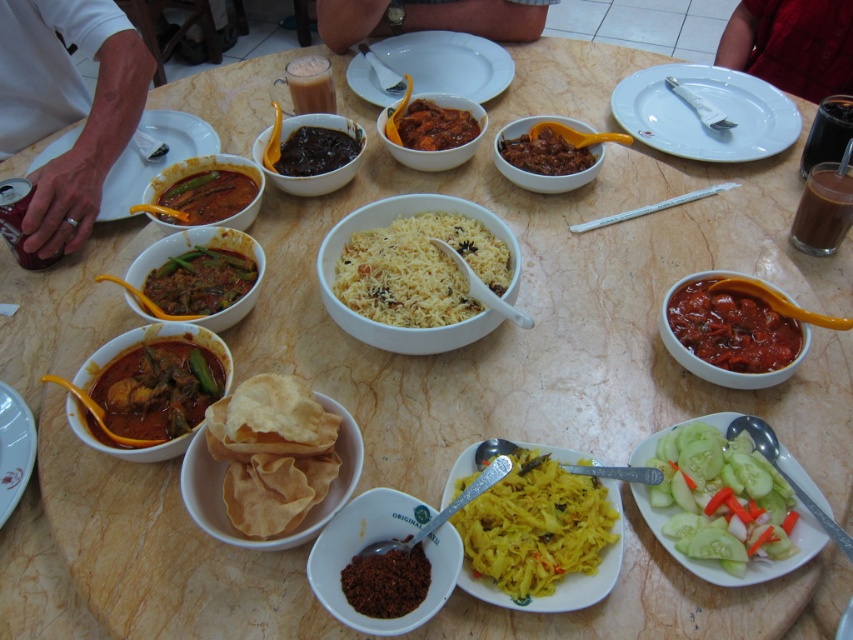
Who is more forward, (169, 435) or (495, 84)?

Point (169, 435) is in front.

Measure the distance between matte red curry at center and camera.

matte red curry at center is 71.37 centimeters away from camera.

Find the location of a particular element. The height and width of the screenshot is (640, 853). matte red curry at center is located at coordinates (x=154, y=392).

Which of these two, smooth skin hand at left or sliced cucumber at center, stands shorter?

Standing shorter between the two is sliced cucumber at center.

Can you confirm if smooth skin hand at left is wider than sliced cucumber at center?

Yes.

Who is more distant from viewer, (x=68, y=22) or (x=801, y=516)?

Point (x=68, y=22)

You are a GUI agent. You are given a task and a screenshot of the screen. Output one action in this format:
    pyautogui.click(x=<x>, y=<y>)
    Task: Click on the smooth skin hand at left
    The height and width of the screenshot is (640, 853).
    Given the screenshot: What is the action you would take?
    pyautogui.click(x=68, y=106)

Between point (343, 593) and point (244, 196), which one is positioned in front?

Point (343, 593) is in front.

Who is lower down, dark brown paste at center or matte green curry at center left?

dark brown paste at center is below.

Describe the element at coordinates (386, 580) in the screenshot. I see `dark brown paste at center` at that location.

Find the location of a particular element. The height and width of the screenshot is (640, 853). dark brown paste at center is located at coordinates (386, 580).